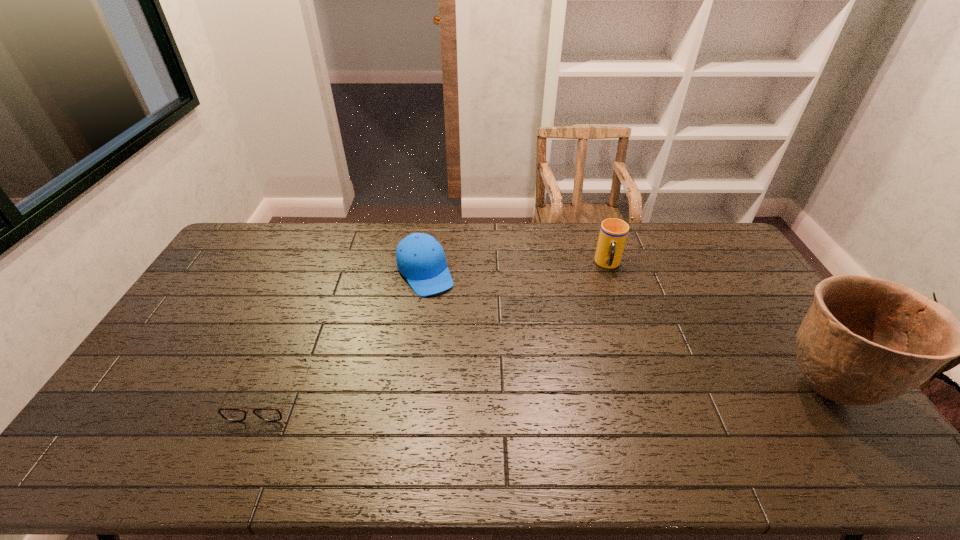
Where is `object that is at the near right corner`? The height and width of the screenshot is (540, 960). object that is at the near right corner is located at coordinates (864, 341).

This screenshot has width=960, height=540. What are the coordinates of `free space at the far edge` in the screenshot? It's located at (361, 247).

What are the coordinates of `free space at the near edge of the desktop` in the screenshot? It's located at [x=473, y=400].

The height and width of the screenshot is (540, 960). I want to click on vacant space at the left edge, so click(174, 345).

Where is `vacant space at the right edge of the desktop`? The height and width of the screenshot is (540, 960). vacant space at the right edge of the desktop is located at coordinates (751, 302).

At what (x,y) coordinates should I click in order to perform the action: click on free space at the far left corner of the desktop. Please return your answer as a coordinate pair (x, y). Looking at the image, I should click on (274, 223).

Identify the location of vacant area between the second tallest object and the tallest object. This screenshot has width=960, height=540. (717, 327).

Where is `vacant point located between the third shortest object and the sunglasses`? The width and height of the screenshot is (960, 540). vacant point located between the third shortest object and the sunglasses is located at coordinates (438, 328).

Locate an element on the screen. Image resolution: width=960 pixels, height=540 pixels. vacant area that lies between the third shortest object and the leftmost object is located at coordinates (438, 328).

I want to click on free space that is in between the third tallest object and the rightmost object, so click(x=625, y=331).